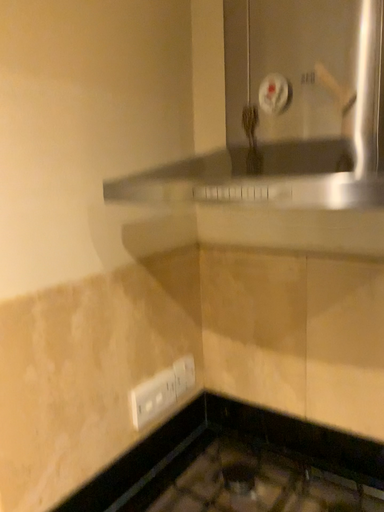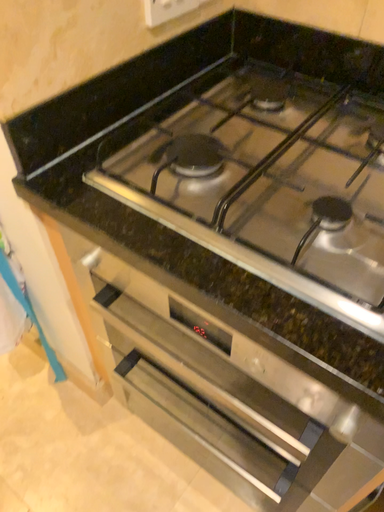
Question: Which way did the camera rotate in the video?

Choices:
 (A) rotated downward
 (B) rotated upward

Answer: (A)